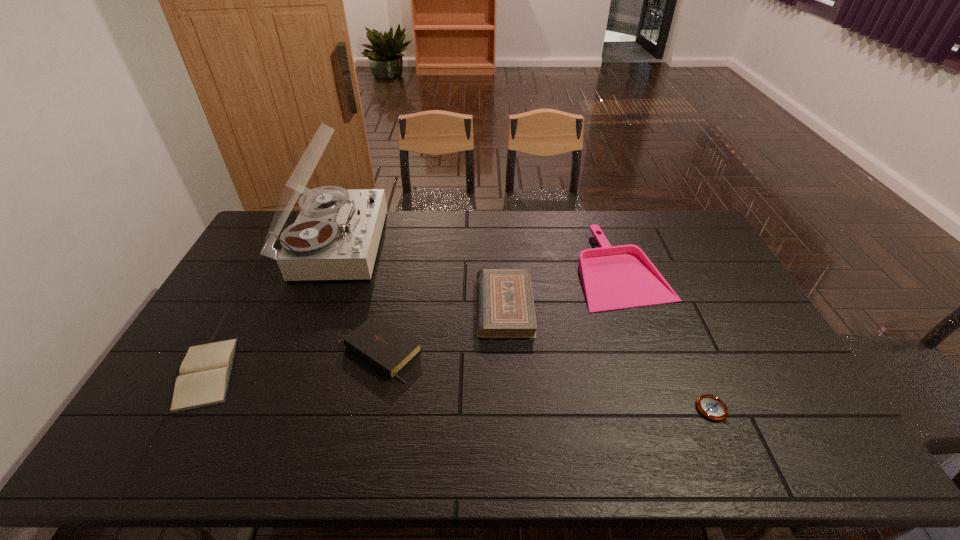
The image size is (960, 540). I want to click on object located at the far left corner, so click(336, 235).

In the image, there is a desktop. Identify the location of free space at the far edge. This screenshot has width=960, height=540. (486, 236).

Image resolution: width=960 pixels, height=540 pixels. In order to click on vacant area at the near edge in this screenshot , I will do `click(245, 454)`.

The width and height of the screenshot is (960, 540). I want to click on free space at the left edge of the desktop, so click(x=239, y=292).

This screenshot has height=540, width=960. What are the coordinates of `vacant region at the right edge` in the screenshot? It's located at (754, 389).

I want to click on vacant region at the far right corner of the desktop, so click(x=691, y=221).

Locate an element on the screen. free space between the compass and the dustpan is located at coordinates (667, 339).

Where is `vacant region between the tallest object and the leftmost Bible`? vacant region between the tallest object and the leftmost Bible is located at coordinates (271, 308).

Where is `empty space that is in between the shortest object and the second Bible from left to right`? This screenshot has height=540, width=960. empty space that is in between the shortest object and the second Bible from left to right is located at coordinates (547, 381).

What are the coordinates of `blank region between the second Bible from left to right and the leftmost Bible` in the screenshot? It's located at (295, 362).